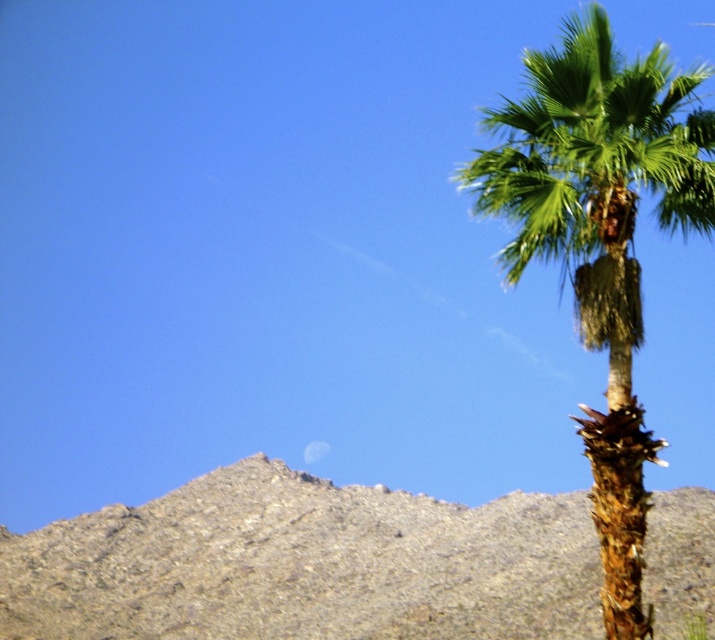
Between gray rocky mountain at center and green leafy palm at right, which one has more height?

With more height is green leafy palm at right.

Is gray rocky mountain at center wider than green leafy palm at right?

Indeed, gray rocky mountain at center has a greater width compared to green leafy palm at right.

Find the location of a particular element. The height and width of the screenshot is (640, 715). gray rocky mountain at center is located at coordinates (305, 564).

Identify the location of gray rocky mountain at center. (305, 564).